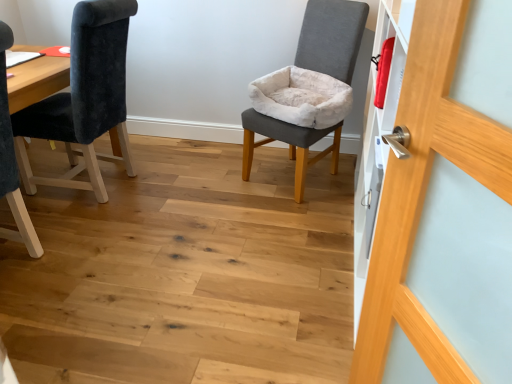
Where is `vacant space that's between gray fabric chair at center, the 1th chair viewed from the right, and velvet dark blue chair at left, the 2th chair viewed from the right`? The image size is (512, 384). vacant space that's between gray fabric chair at center, the 1th chair viewed from the right, and velvet dark blue chair at left, the 2th chair viewed from the right is located at coordinates (211, 180).